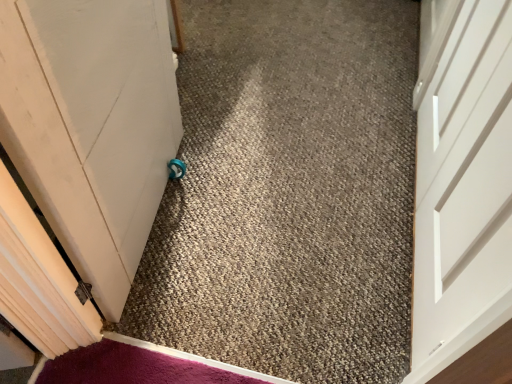
Find the location of a particular element. This screenshot has width=512, height=384. white matte door at center is located at coordinates (463, 185).

Describe the element at coordinates (463, 185) in the screenshot. I see `white matte door at center` at that location.

Image resolution: width=512 pixels, height=384 pixels. What are the coordinates of `white matte door at center` in the screenshot? It's located at (463, 185).